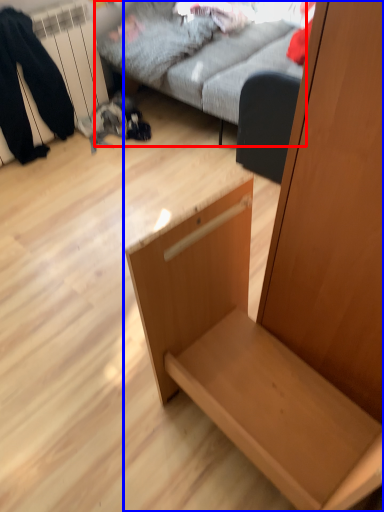
Question: Which object appears closest to the camera in this image, studio couch (highlighted by a red box) or furniture (highlighted by a blue box)?

Choices:
 (A) studio couch
 (B) furniture

Answer: (B)